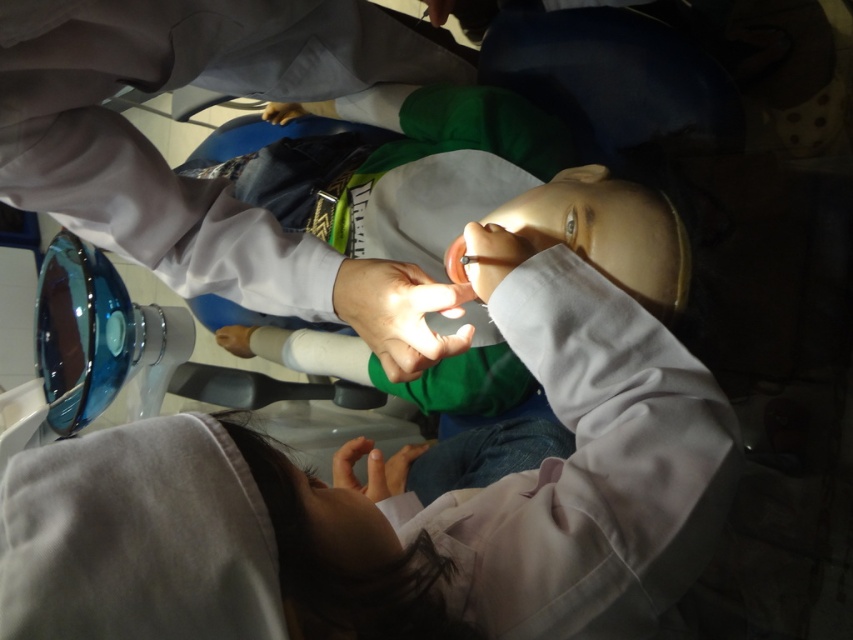
You are a medical student observing a simulation. You notice two items near the mannequin. One is a smooth skin hand at center, and the other is a matte black glove at upper center. Which item is smaller in size?

The smooth skin hand at center is smaller in size compared to the matte black glove at upper center.

Based on the scene description, where is the matte white hand at center positioned relative to the mannequin?

The matte white hand at center is located at point 0.531 on the x axis and 0.277 on the y axis, which is near the mannequin.